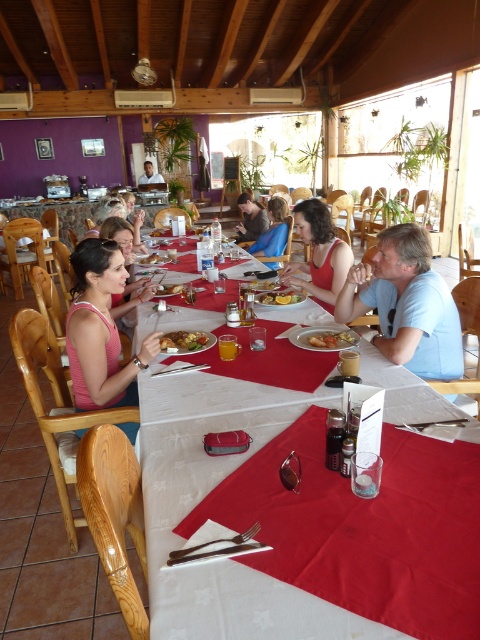
Can you confirm if blue fabric shirt at center is bigger than golden fried chicken at center?

Indeed, blue fabric shirt at center has a larger size compared to golden fried chicken at center.

The image size is (480, 640). Describe the element at coordinates (273, 230) in the screenshot. I see `blue fabric shirt at center` at that location.

Is point (276, 227) positioned before point (268, 282)?

No, it is not.

I want to click on blue fabric shirt at center, so tap(273, 230).

In the scene shown: Does pink fabric top at left lie behind matte black shirt at upper center?

No, it is not.

Is pink fabric top at left below matte black shirt at upper center?

Indeed, pink fabric top at left is positioned under matte black shirt at upper center.

Is point (82, 289) farther from camera compared to point (153, 170)?

No.

Where is `pink fabric top at left`? pink fabric top at left is located at coordinates (100, 330).

Does blue fabric shirt at center have a greater width compared to matte brown bread at center?

Yes.

Is point (277, 208) positioned after point (160, 294)?

Yes, point (277, 208) is behind point (160, 294).

Does point (256, 250) come farther from viewer compared to point (163, 291)?

That is True.

You are a GUI agent. You are given a task and a screenshot of the screen. Output one action in this format:
    pyautogui.click(x=<x>, y=<y>)
    Task: Click on the blue fabric shirt at center
    This screenshot has width=480, height=640.
    Given the screenshot: What is the action you would take?
    pyautogui.click(x=273, y=230)